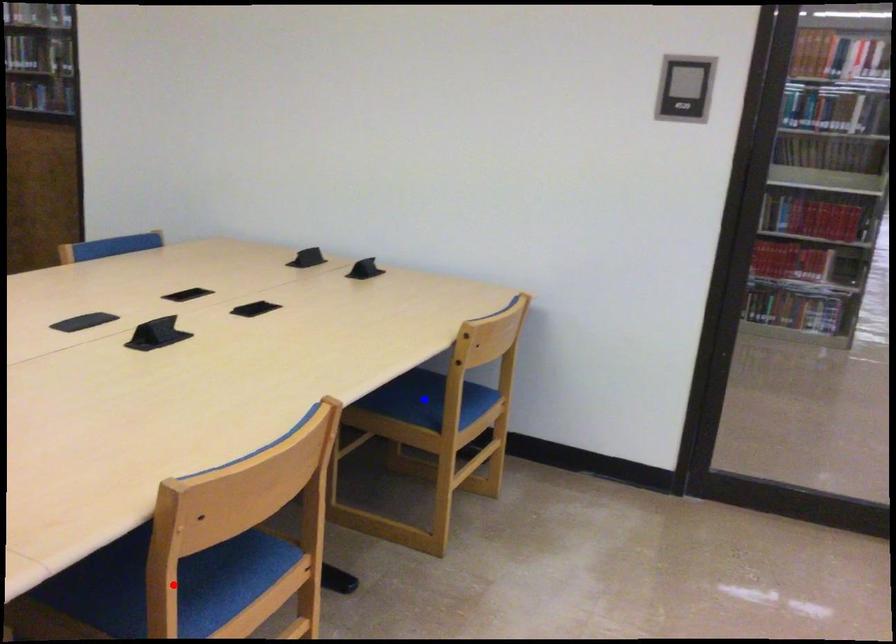
Question: In the image, two points are highlighted. Which point is nearer to the camera? Reply with the corresponding letter.

Choices:
 (A) blue point
 (B) red point

Answer: (B)